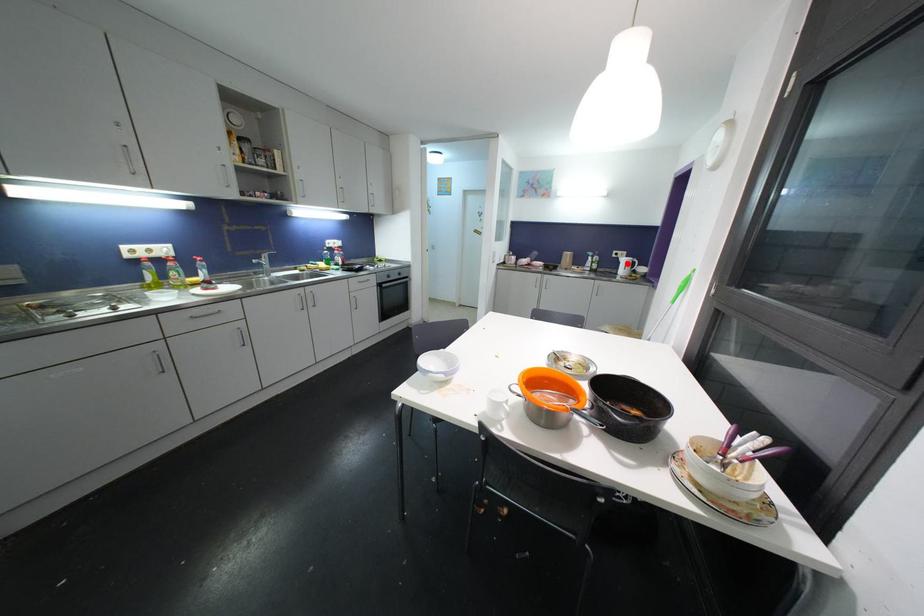
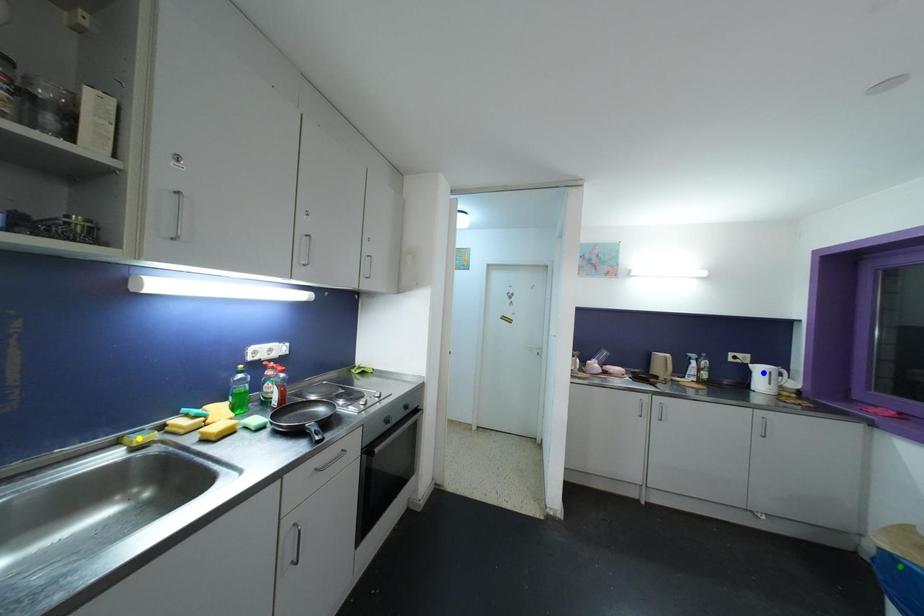
Question: I am providing you with two images of the same scene from different viewpoints. A red point is marked on the first image. You are given multiple points on the second image. Which point in image 2 represents the same 3d spot as the red point in image 1?

Choices:
 (A) yellow point
 (B) green point
 (C) blue point

Answer: (C)